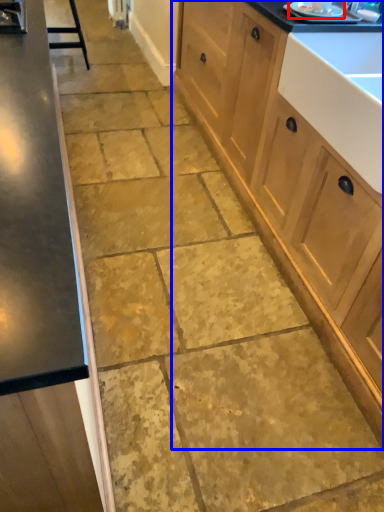
Question: Which of the following is the farthest to the observer, appliance (highlighted by a red box) or cabinetry (highlighted by a blue box)?

Choices:
 (A) appliance
 (B) cabinetry

Answer: (A)